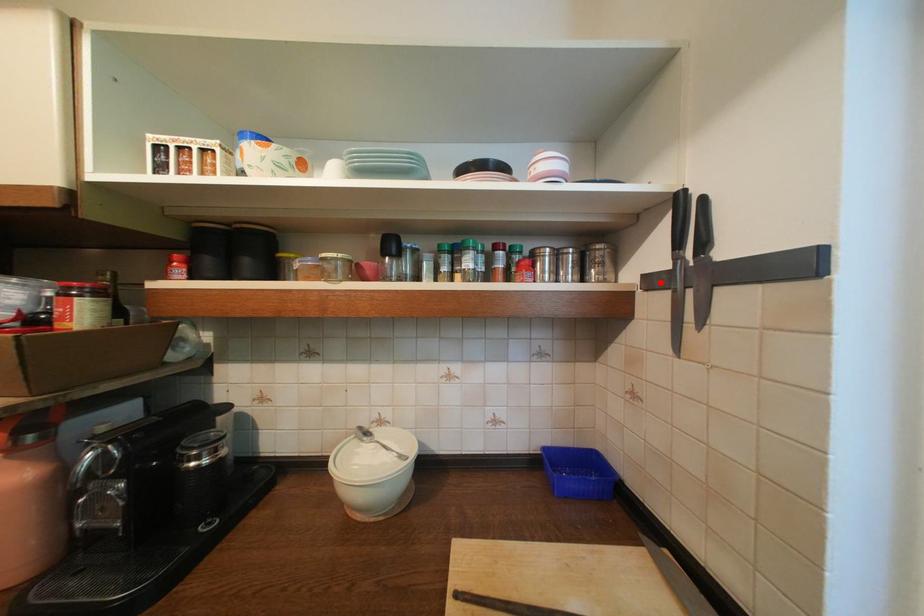
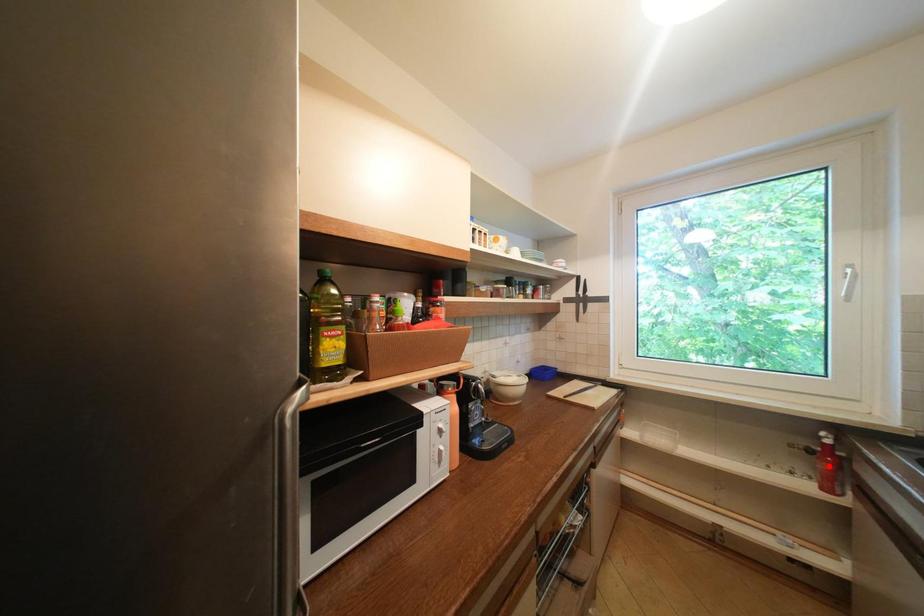
I am providing you with two images of the same scene from different viewpoints. A red point is marked on the first image and another point is marked on the second image. Are the points marked in image1 and image2 representing the same 3D position?

No